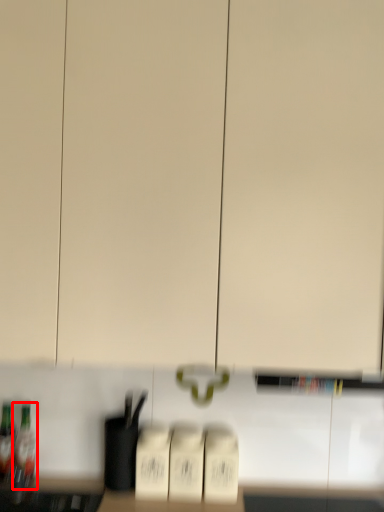
Question: From the image's perspective, what is the correct spatial positioning of bottle (annotated by the red box) in reference to bottle?

Choices:
 (A) below
 (B) above

Answer: (A)